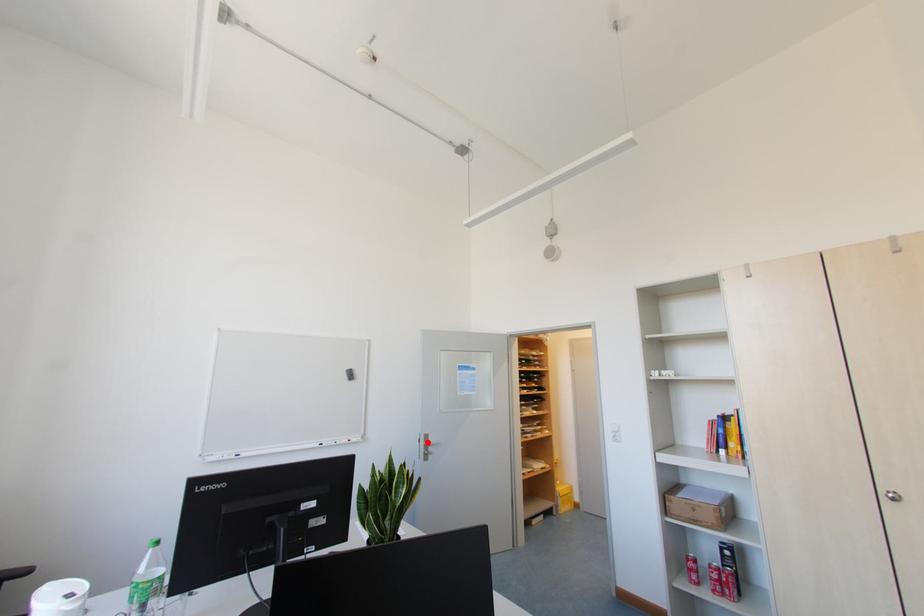
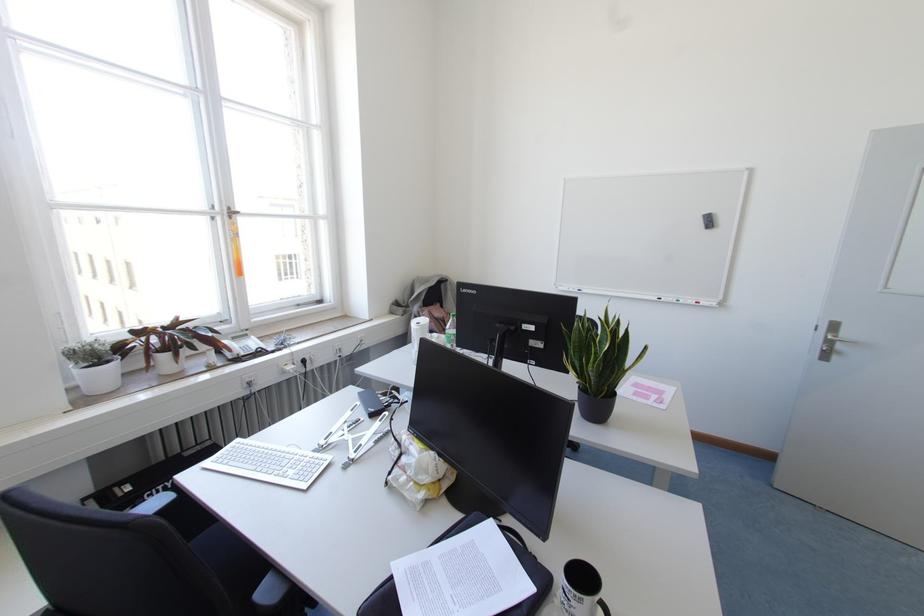
Question: A red point is marked in image1. In image2, is the corresponding 3D point closer to the camera or farther? Reply with the corresponding letter.

Choices:
 (A) The corresponding 3D point is closer.
 (B) The corresponding 3D point is farther.

Answer: (A)